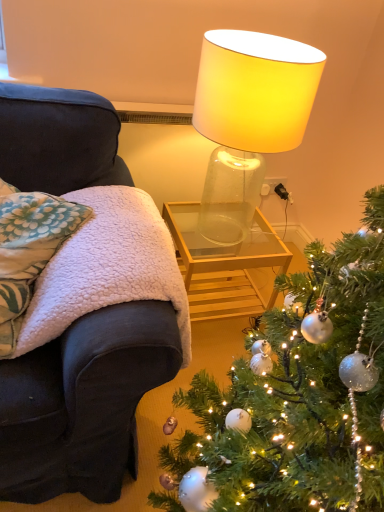
Question: From a real-world perspective, is transparent glass table at center physically above fluffy white pillow at left?

Choices:
 (A) yes
 (B) no

Answer: (B)

Question: Does transparent glass table at center come in front of fluffy white pillow at left?

Choices:
 (A) yes
 (B) no

Answer: (B)

Question: Is transparent glass table at center positioned with its back to fluffy white pillow at left?

Choices:
 (A) yes
 (B) no

Answer: (B)

Question: Can you confirm if transparent glass table at center is positioned to the right of fluffy white pillow at left?

Choices:
 (A) yes
 (B) no

Answer: (A)

Question: Is transparent glass table at center wider than fluffy white pillow at left?

Choices:
 (A) no
 (B) yes

Answer: (B)

Question: Considering the positions of white fleece blanket at left and fluffy white pillow at left in the image, is white fleece blanket at left wider or thinner than fluffy white pillow at left?

Choices:
 (A) thin
 (B) wide

Answer: (B)

Question: From a real-world perspective, is white fleece blanket at left positioned above or below fluffy white pillow at left?

Choices:
 (A) below
 (B) above

Answer: (A)

Question: In terms of height, does white fleece blanket at left look taller or shorter compared to fluffy white pillow at left?

Choices:
 (A) short
 (B) tall

Answer: (B)

Question: Is white fleece blanket at left in front of or behind fluffy white pillow at left in the image?

Choices:
 (A) behind
 (B) front

Answer: (B)

Question: In terms of width, does translucent glass lamp at upper center look wider or thinner when compared to shiny silver ornaments at lower right?

Choices:
 (A) wide
 (B) thin

Answer: (B)

Question: Looking at the image, does translucent glass lamp at upper center seem bigger or smaller compared to shiny silver ornaments at lower right?

Choices:
 (A) small
 (B) big

Answer: (A)

Question: From a real-world perspective, relative to shiny silver ornaments at lower right, is translucent glass lamp at upper center vertically above or below?

Choices:
 (A) above
 (B) below

Answer: (A)

Question: Is translucent glass lamp at upper center in front of or behind shiny silver ornaments at lower right in the image?

Choices:
 (A) behind
 (B) front

Answer: (A)

Question: From a real-world perspective, relative to translucent glass lamp at upper center, is white fleece blanket at left vertically above or below?

Choices:
 (A) below
 (B) above

Answer: (A)

Question: Looking at the image, does white fleece blanket at left seem bigger or smaller compared to translucent glass lamp at upper center?

Choices:
 (A) big
 (B) small

Answer: (B)